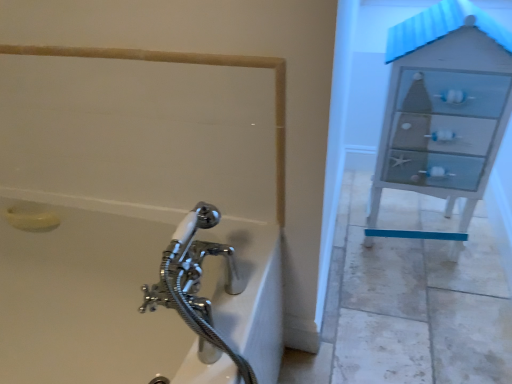
The image size is (512, 384). Identify the location of free space below white glossy file cabinet at right (from a real-world perspective). (419, 244).